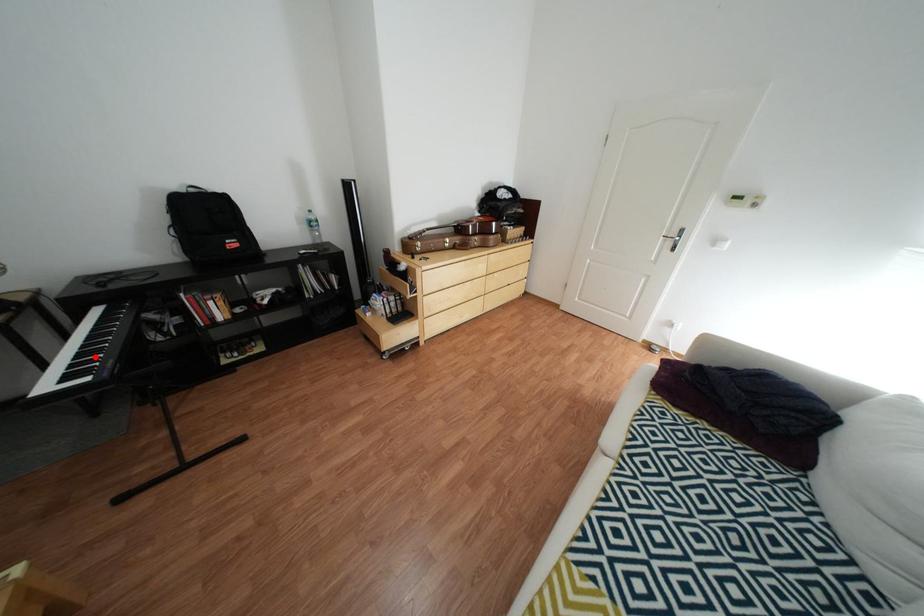
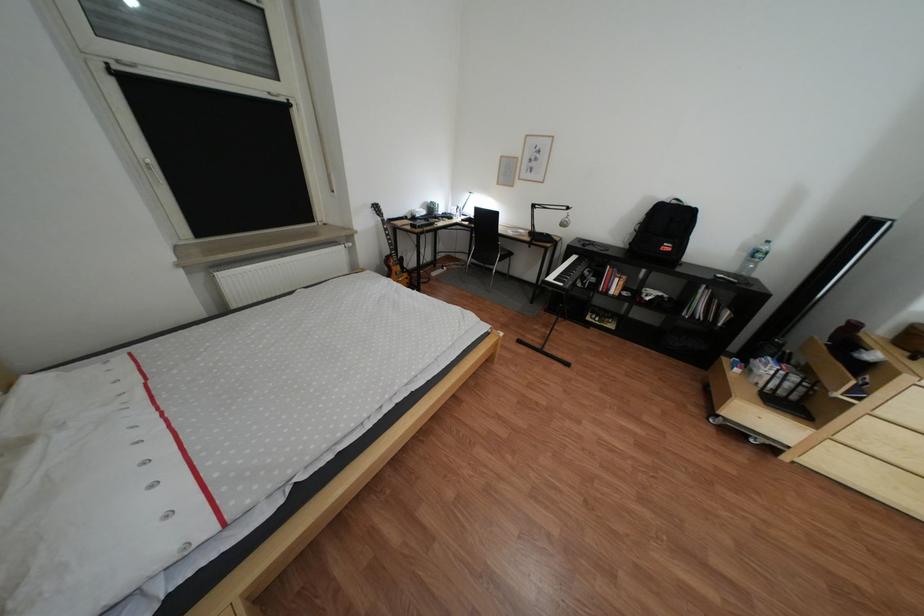
Question: I am providing you with two images of the same scene from different viewpoints. In image1, a red point is highlighted. Considering the same 3D point in image2, which of the following is correct?

Choices:
 (A) It is closer
 (B) It is farther

Answer: (B)